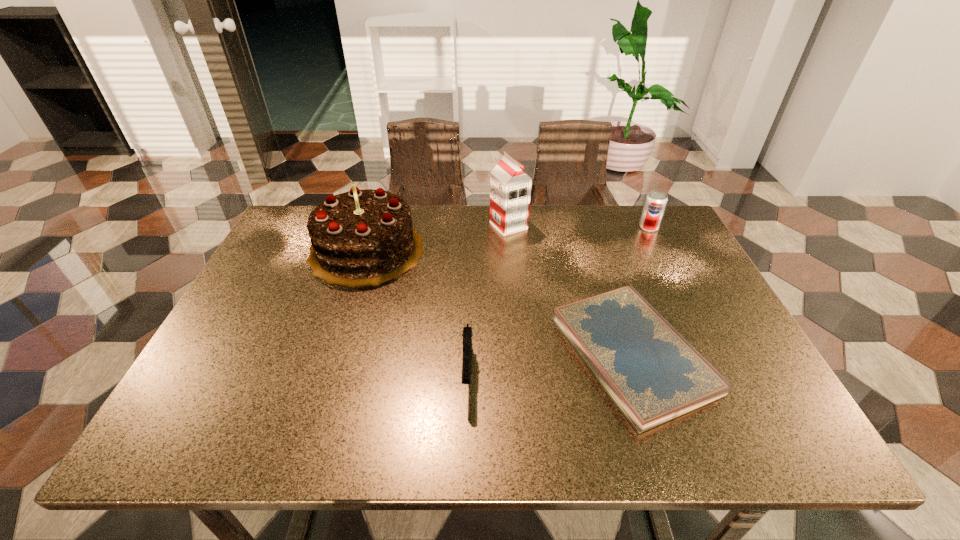
This screenshot has height=540, width=960. I want to click on free location at the far edge of the desktop, so [547, 235].

Image resolution: width=960 pixels, height=540 pixels. Find the location of `free space at the near edge of the desktop`. free space at the near edge of the desktop is located at coordinates (414, 424).

Where is `vacant position at the left edge of the desktop`? The image size is (960, 540). vacant position at the left edge of the desktop is located at coordinates (254, 289).

Identify the location of vacant space at the right edge of the desktop. This screenshot has width=960, height=540. (701, 350).

Locate an element on the screen. The image size is (960, 540). free spot between the leftmost object and the paperback book is located at coordinates (499, 302).

Find the location of a particular element. free space between the shortest object and the birthday cake is located at coordinates (499, 302).

Image resolution: width=960 pixels, height=540 pixels. I want to click on vacant space in between the third object from right to left and the birthday cake, so click(438, 238).

Where is `free space that is in between the soda and the pistol`? The height and width of the screenshot is (540, 960). free space that is in between the soda and the pistol is located at coordinates (558, 300).

What are the coordinates of `vacant space that's between the shortest object and the third tallest object` in the screenshot? It's located at (640, 291).

The image size is (960, 540). What are the coordinates of `vacant space that's between the birthday cake and the shortest object` in the screenshot? It's located at (499, 302).